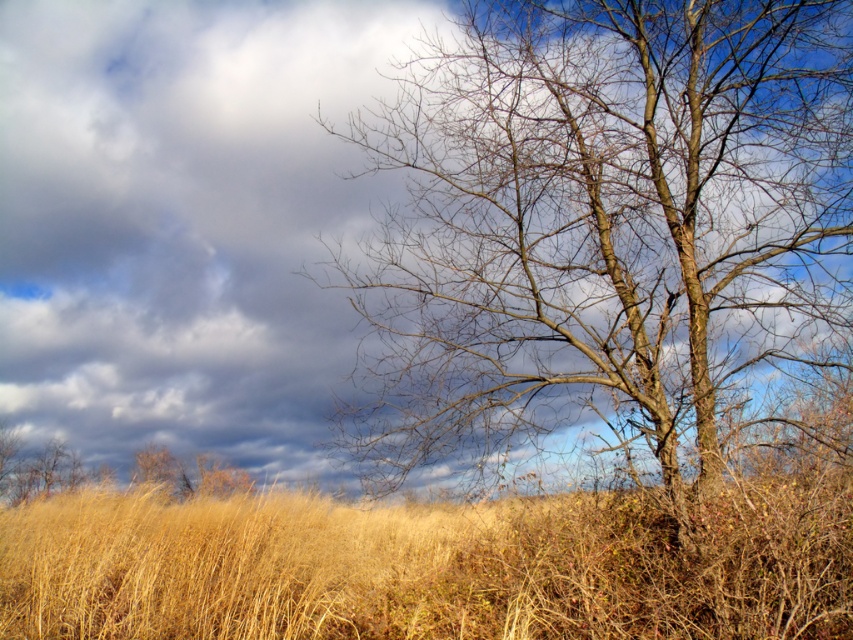
Between point (498, 369) and point (833, 604), which one is positioned behind?

The point (498, 369) is more distant.

In the scene shown: Who is positioned more to the right, bark textured tree at right or dry grass at center?

Positioned to the right is bark textured tree at right.

Which is in front, point (461, 253) or point (726, 534)?

Point (726, 534) is more forward.

Find the location of a particular element. The width and height of the screenshot is (853, 640). bark textured tree at right is located at coordinates (602, 221).